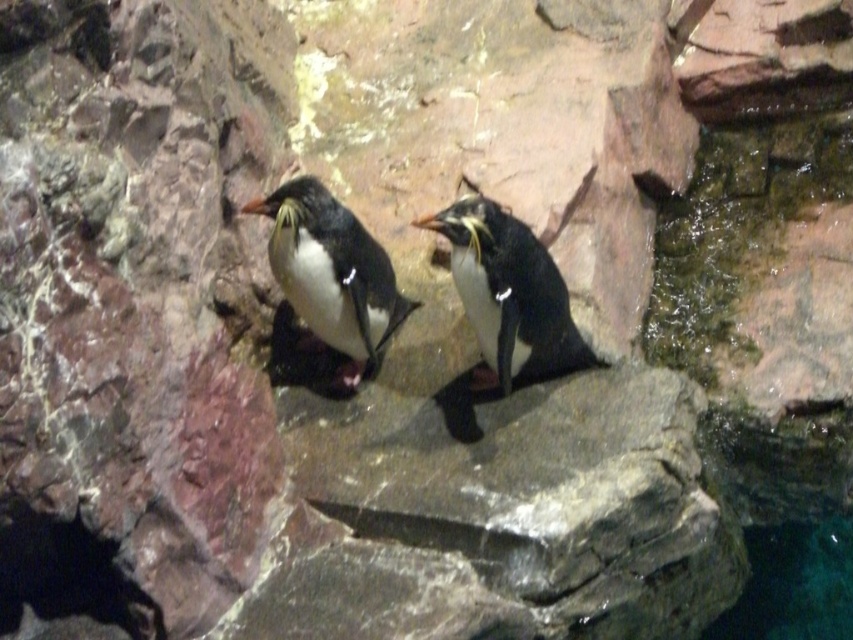
Question: In this image, where is black matte penguin at center located relative to white matte penguin at center?

Choices:
 (A) above
 (B) below

Answer: (B)

Question: Which point is farther from the camera taking this photo?

Choices:
 (A) (538, 300)
 (B) (331, 228)

Answer: (A)

Question: Is black matte penguin at center positioned in front of clear blue water at lower right?

Choices:
 (A) yes
 (B) no

Answer: (A)

Question: Which object appears farthest from the camera in this image?

Choices:
 (A) black matte penguin at center
 (B) clear blue water at lower right

Answer: (B)

Question: Is black matte penguin at center bigger than clear blue water at lower right?

Choices:
 (A) yes
 (B) no

Answer: (A)

Question: Estimate the real-world distances between objects in this image. Which object is closer to the black matte penguin at center?

Choices:
 (A) clear blue water at lower right
 (B) white matte penguin at center

Answer: (B)